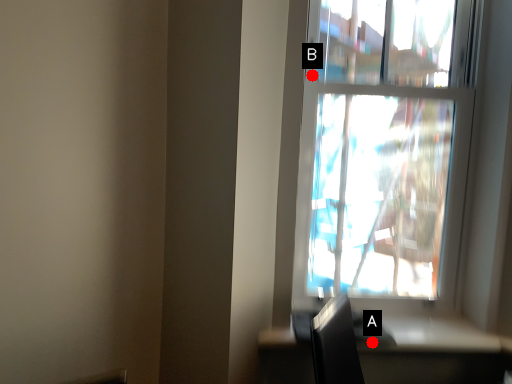
Question: Two points are circled on the image, labeled by A and B beside each circle. Which point is closer to the camera?

Choices:
 (A) A is closer
 (B) B is closer

Answer: (A)